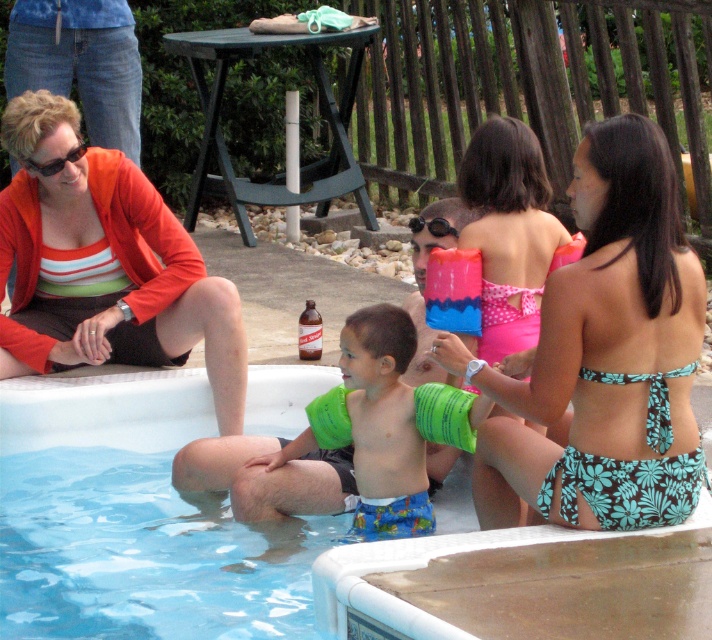
You are a photographer at the pool party and want to capture a closeup shot of both the green rubber arm bands at lower center and the matte black sunglasses at upper left. Since you can only focus on one object at a time, which object should you choose to ensure the other is still in the background?

The green rubber arm bands at lower center are larger in size compared to the matte black sunglasses at upper left. To ensure the smaller matte black sunglasses at upper left are visible in the background, you should focus on the green rubber arm bands at lower center.

You are a guest at the pool party and want to check if the green rubber arm bands at center are visible from above the green rubber arm bands at lower center. Based on their positions, can you see them?

The green rubber arm bands at center are positioned under the green rubber arm bands at lower center, so they are not visible from above.